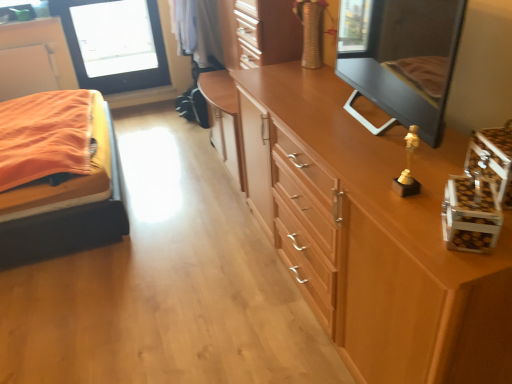
What is the approximate height of orange fabric bed at left?

orange fabric bed at left is 31.81 inches tall.

In order to click on transparent glass window screen at upper left in this screenshot , I will do [x=114, y=43].

The width and height of the screenshot is (512, 384). I want to click on wooden dresser at center, so click(x=259, y=32).

This screenshot has width=512, height=384. What are the coordinates of `light brown wood chest of drawers at upper right` in the screenshot? It's located at (373, 236).

Is matte black mirror at upper right far away from transparent glass window screen at upper left?

Yes.

Which of these two, matte black mirror at upper right or transparent glass window screen at upper left, is thinner?

transparent glass window screen at upper left is thinner.

Could you measure the distance between matte black mirror at upper right and transparent glass window screen at upper left?

matte black mirror at upper right and transparent glass window screen at upper left are 10.17 feet apart.

From the image's perspective, would you say wooden dresser at center is positioned over matte black mirror at upper right?

Yes.

Are wooden dresser at center and matte black mirror at upper right beside each other?

No, wooden dresser at center is not next to matte black mirror at upper right.

Consider the image. Based on their sizes in the image, would you say wooden dresser at center is bigger or smaller than matte black mirror at upper right?

Considering their sizes, wooden dresser at center takes up more space than matte black mirror at upper right.

In terms of width, does wooden dresser at center look wider or thinner when compared to matte black mirror at upper right?

Clearly, wooden dresser at center has more width compared to matte black mirror at upper right.

From a real-world perspective, does matte black mirror at upper right stand above light brown wood chest of drawers at upper right?

Yes, from a real-world perspective, matte black mirror at upper right is on top of light brown wood chest of drawers at upper right.

Which is behind, matte black mirror at upper right or light brown wood chest of drawers at upper right?

matte black mirror at upper right is more distant.

Considering the sizes of objects matte black mirror at upper right and light brown wood chest of drawers at upper right in the image provided, who is shorter, matte black mirror at upper right or light brown wood chest of drawers at upper right?

matte black mirror at upper right.

Is matte black mirror at upper right located outside light brown wood chest of drawers at upper right?

Yes, matte black mirror at upper right is located beyond the bounds of light brown wood chest of drawers at upper right.

Is orange fabric bed at left oriented away from light brown wood chest of drawers at upper right?

That's not correct — orange fabric bed at left is not looking away from light brown wood chest of drawers at upper right.

From a real-world perspective, is orange fabric bed at left on top of light brown wood chest of drawers at upper right?

No, from a real-world perspective, orange fabric bed at left is not over light brown wood chest of drawers at upper right

Can you confirm if orange fabric bed at left is thinner than light brown wood chest of drawers at upper right?

Incorrect, the width of orange fabric bed at left is not less than that of light brown wood chest of drawers at upper right.

From the image's perspective, is wooden dresser at center positioned above or below light brown wood chest of drawers at upper right?

Clearly, from the image's perspective, wooden dresser at center is above light brown wood chest of drawers at upper right.

Based on the photo, is light brown wood chest of drawers at upper right at the back of wooden dresser at center?

wooden dresser at center does not have its back to light brown wood chest of drawers at upper right.

Which of these two, wooden dresser at center or light brown wood chest of drawers at upper right, is smaller?

wooden dresser at center is smaller.

Does wooden dresser at center appear on the right side of light brown wood chest of drawers at upper right?

No, wooden dresser at center is not to the right of light brown wood chest of drawers at upper right.

Is light brown wood chest of drawers at upper right next to matte black mirror at upper right?

No, light brown wood chest of drawers at upper right is not making contact with matte black mirror at upper right.

At what (x,y) coordinates should I click in order to perform the action: click on the chest of drawers in front of the matte black mirror at upper right. Please return your answer as a coordinate pair (x, y). This screenshot has width=512, height=384. Looking at the image, I should click on (373, 236).

From the image's perspective, is wooden dresser at center above orange fabric bed at left?

Yes, from the image's perspective, wooden dresser at center is over orange fabric bed at left.

From a real-world perspective, between wooden dresser at center and orange fabric bed at left, who is vertically lower?

orange fabric bed at left is physically lower.

Is wooden dresser at center shorter than orange fabric bed at left?

No, wooden dresser at center is not shorter than orange fabric bed at left.

This screenshot has height=384, width=512. Find the location of `mirror lying below the transparent glass window screen at upper left (from the image's perspective)`. mirror lying below the transparent glass window screen at upper left (from the image's perspective) is located at coordinates (408, 61).

Find the location of a particular element. The image size is (512, 384). mirror that is in front of the wooden dresser at center is located at coordinates (408, 61).

Which object lies further to the anchor point wooden dresser at center, transparent glass window screen at upper left or light brown wood chest of drawers at upper right?

transparent glass window screen at upper left is further to wooden dresser at center.

Considering their positions, is light brown wood chest of drawers at upper right positioned closer to orange fabric bed at left than matte black mirror at upper right?

light brown wood chest of drawers at upper right is closer to orange fabric bed at left.

When comparing their distances from light brown wood chest of drawers at upper right, does transparent glass window screen at upper left or orange fabric bed at left seem closer?

The object closer to light brown wood chest of drawers at upper right is orange fabric bed at left.

Looking at the image, which one is located closer to light brown wood chest of drawers at upper right, transparent glass window screen at upper left or matte black mirror at upper right?

matte black mirror at upper right.

Looking at the image, which one is located closer to matte black mirror at upper right, orange fabric bed at left or light brown wood chest of drawers at upper right?

light brown wood chest of drawers at upper right lies closer to matte black mirror at upper right than the other object.

Based on their spatial positions, is orange fabric bed at left or matte black mirror at upper right further from wooden dresser at center?

Based on the image, orange fabric bed at left appears to be further to wooden dresser at center.

Estimate the real-world distances between objects in this image. Which object is closer to transparent glass window screen at upper left, orange fabric bed at left or light brown wood chest of drawers at upper right?

orange fabric bed at left is closer to transparent glass window screen at upper left.

Considering their positions, is light brown wood chest of drawers at upper right positioned further to orange fabric bed at left than wooden dresser at center?

light brown wood chest of drawers at upper right is positioned further to the anchor orange fabric bed at left.

This screenshot has width=512, height=384. I want to click on dresser positioned between light brown wood chest of drawers at upper right and transparent glass window screen at upper left from near to far, so click(259, 32).

Where is `dresser between orange fabric bed at left and transparent glass window screen at upper left from front to back`? This screenshot has width=512, height=384. dresser between orange fabric bed at left and transparent glass window screen at upper left from front to back is located at coordinates (259, 32).

Find the location of a particular element. This screenshot has height=384, width=512. dresser located between matte black mirror at upper right and transparent glass window screen at upper left in the depth direction is located at coordinates (259, 32).

Locate an element on the screen. mirror between light brown wood chest of drawers at upper right and wooden dresser at center along the z-axis is located at coordinates (408, 61).